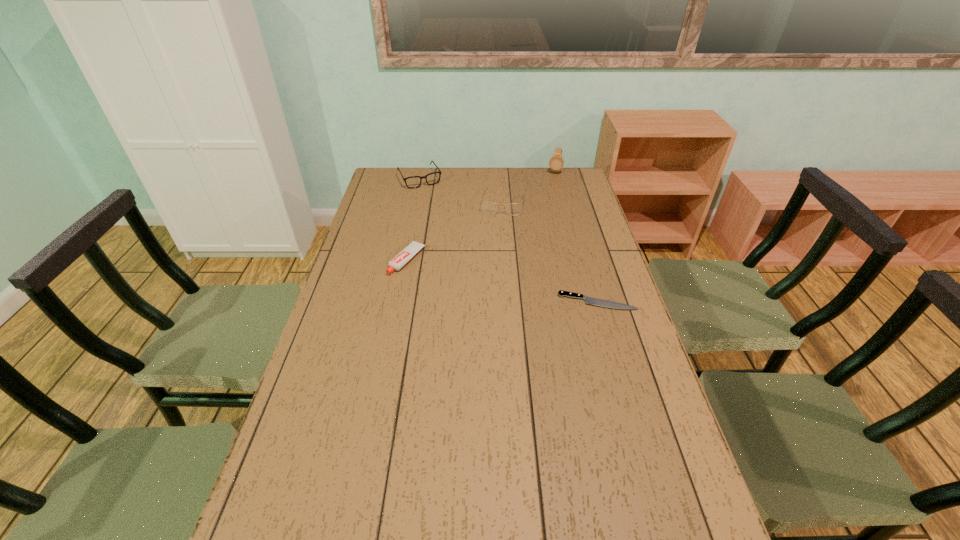
The image size is (960, 540). I want to click on the second shortest object, so click(x=405, y=255).

I want to click on the fourth farthest object, so click(405, 255).

At what (x,y) coordinates should I click in order to perform the action: click on steak knife. Please return your answer as a coordinate pair (x, y). Looking at the image, I should click on (589, 300).

The height and width of the screenshot is (540, 960). I want to click on the shortest object, so click(x=589, y=300).

Locate an element on the screen. The image size is (960, 540). the right spectacles is located at coordinates (487, 207).

You are a GUI agent. You are given a task and a screenshot of the screen. Output one action in this format:
    pyautogui.click(x=<x>, y=<y>)
    Task: Click on the nearer spectacles
    
    Given the screenshot: What is the action you would take?
    pyautogui.click(x=487, y=207)

Find the location of a particular element. the farther spectacles is located at coordinates (432, 178).

At what (x,y) coordinates should I click in order to perform the action: click on watch. Please return your answer as a coordinate pair (x, y). The image size is (960, 540). Looking at the image, I should click on (556, 162).

The width and height of the screenshot is (960, 540). Find the location of `free space located on the front of the toothpaste`. free space located on the front of the toothpaste is located at coordinates [389, 353].

At what (x,y) coordinates should I click in order to perform the action: click on free space located 0.250m on the left of the nearest object. Please return your answer as a coordinate pair (x, y). Looking at the image, I should click on (478, 302).